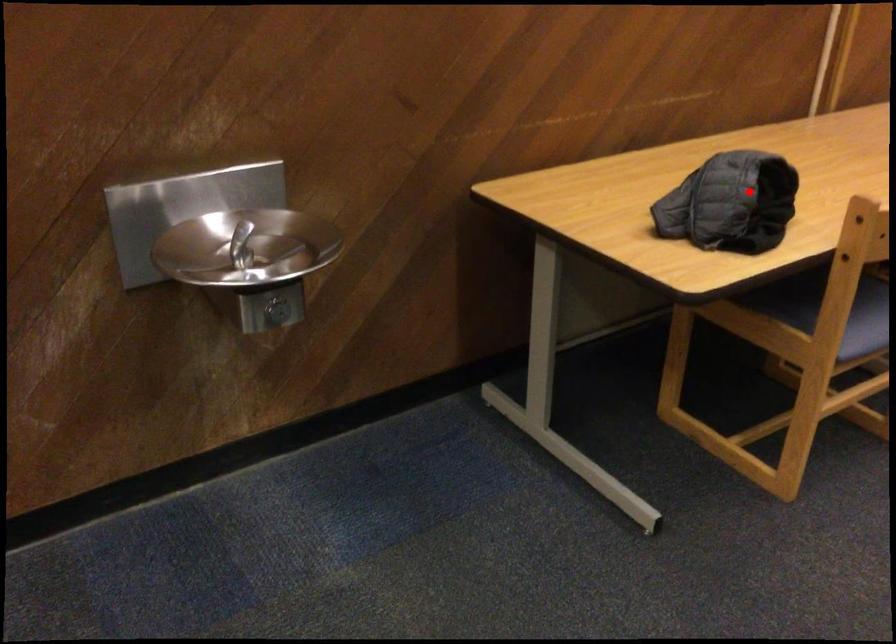
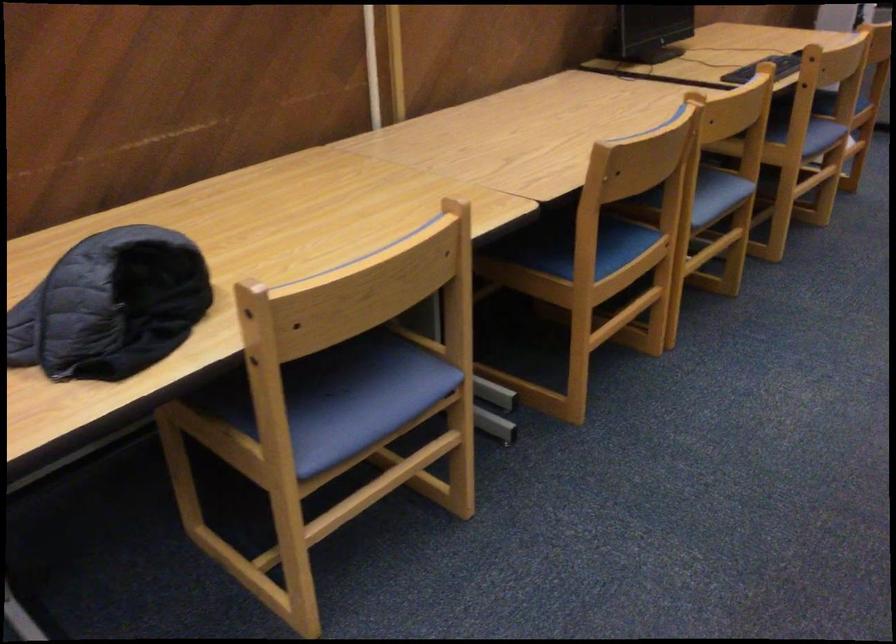
In the second image, find the point that corresponds to the highlighted location in the first image.

(110, 305)